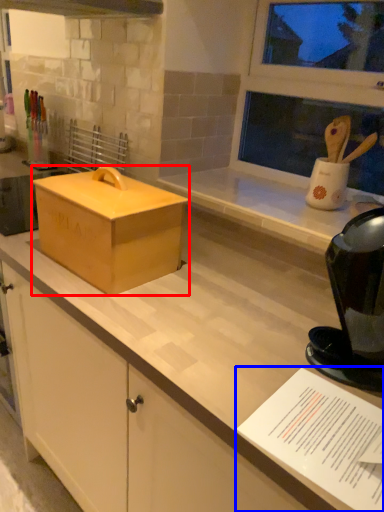
Question: Which object is further to the camera taking this photo, box (highlighted by a red box) or paper (highlighted by a blue box)?

Choices:
 (A) box
 (B) paper

Answer: (A)